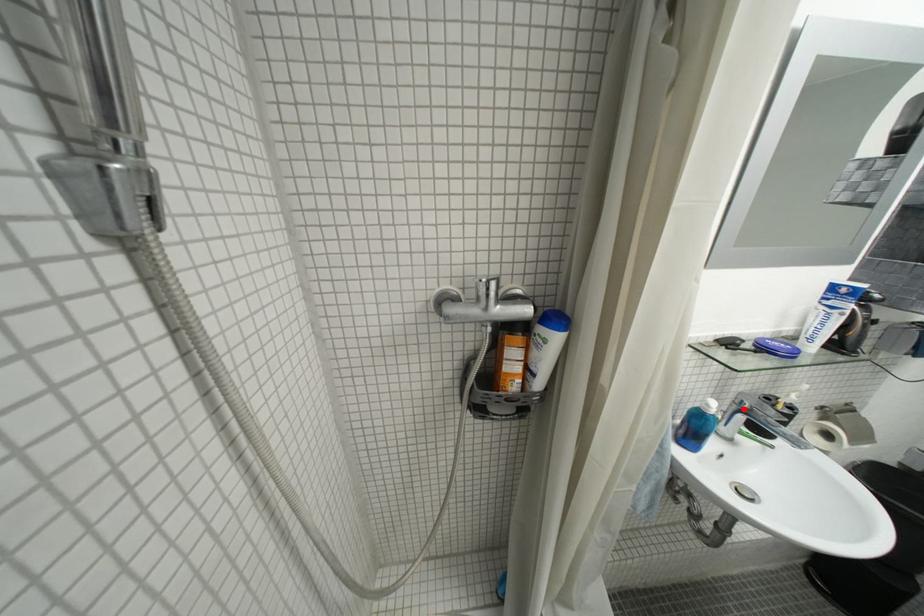
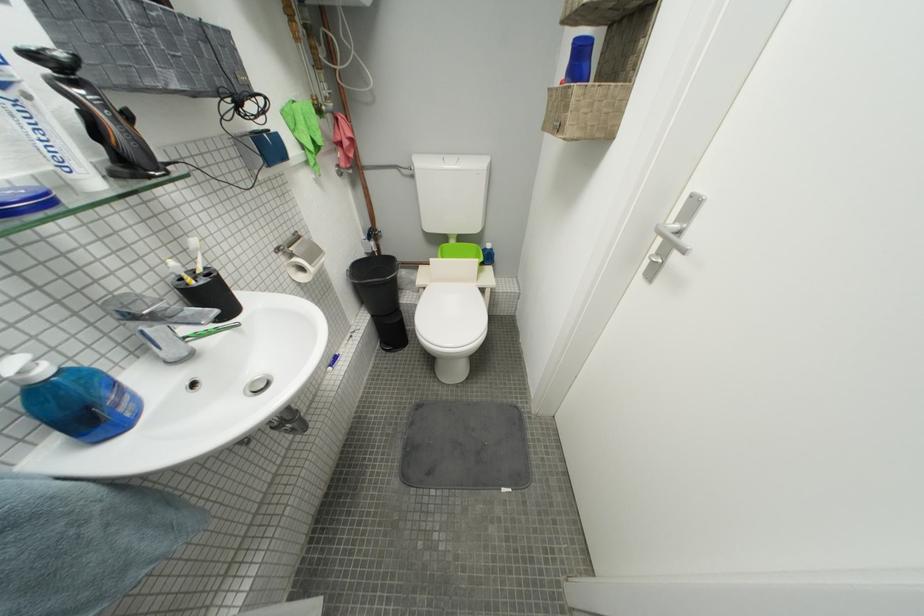
The point at the highlighted location is marked in the first image. Where is the corresponding point in the second image?

(139, 325)